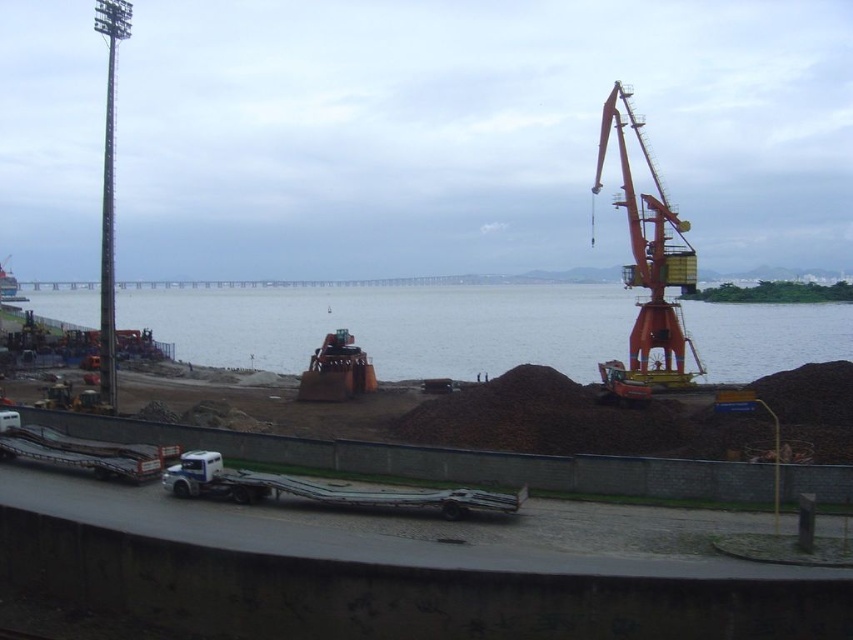
Question: Which object is farther from the camera taking this photo?

Choices:
 (A) blue water at center
 (B) orange metallic crane at right

Answer: (A)

Question: Can you confirm if orange metallic crane at right is positioned above white matte trailer truck at lower left?

Choices:
 (A) no
 (B) yes

Answer: (B)

Question: Estimate the real-world distances between objects in this image. Which object is farther from the white matte trailer truck at lower left?

Choices:
 (A) orange metallic crane at right
 (B) metallic orange boat at left

Answer: (B)

Question: Which object is the closest to the orange metallic crane at right?

Choices:
 (A) metallic orange boat at left
 (B) blue water at center
 (C) white metallic trailer truck at lower center

Answer: (B)

Question: Can you confirm if white metallic trailer truck at lower center is thinner than metallic orange boat at left?

Choices:
 (A) no
 (B) yes

Answer: (B)

Question: Does orange metallic crane at upper right appear over orange metallic crane at right?

Choices:
 (A) no
 (B) yes

Answer: (A)